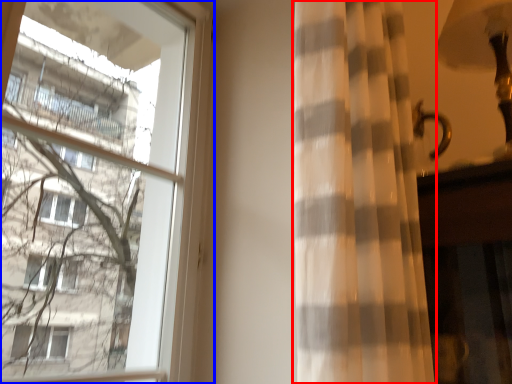
Question: Which object appears farthest to the camera in this image, curtain (highlighted by a red box) or window (highlighted by a blue box)?

Choices:
 (A) curtain
 (B) window

Answer: (B)